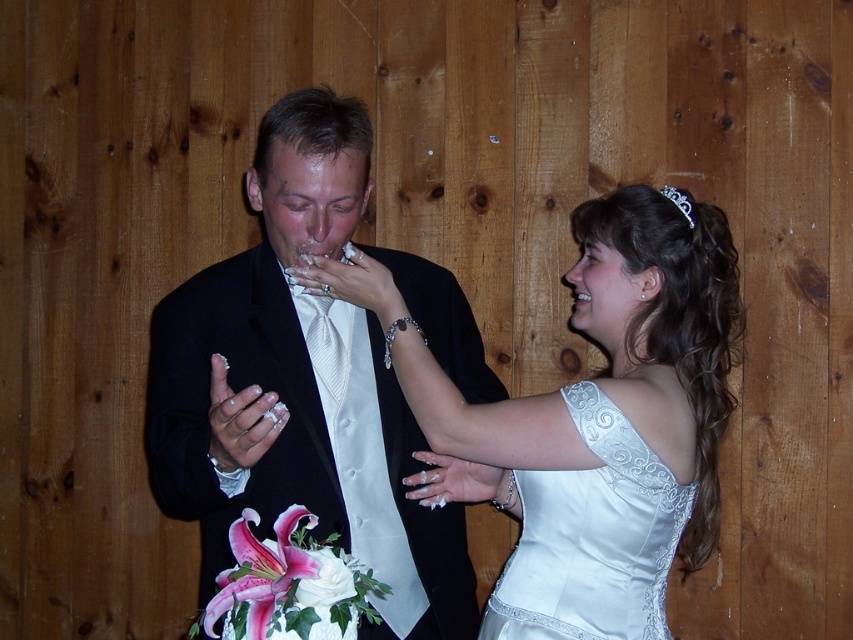
Is satin white dress at center closer to camera compared to satin white dress at upper right?

No, it is behind satin white dress at upper right.

Is satin white dress at center smaller than satin white dress at upper right?

No.

Is point (614, 378) positioned before point (596, 625)?

That is True.

The width and height of the screenshot is (853, 640). I want to click on satin white dress at center, so click(x=593, y=420).

Who is lower down, matte black suit at center or satin white dress at center?

Positioned lower is satin white dress at center.

Does point (457, 589) come closer to viewer compared to point (683, 368)?

No, (457, 589) is behind (683, 368).

Between point (228, 380) and point (622, 317), which one is positioned behind?

The point (622, 317) is behind.

This screenshot has width=853, height=640. Find the location of `matte black suit at center`. matte black suit at center is located at coordinates (299, 387).

Between matte black suit at center and satin white dress at upper right, which one is positioned lower?

satin white dress at upper right

Which is behind, point (401, 451) or point (583, 595)?

The point (401, 451) is behind.

At what (x,y) coordinates should I click in order to perform the action: click on matte black suit at center. Please return your answer as a coordinate pair (x, y). The width and height of the screenshot is (853, 640). Looking at the image, I should click on (299, 387).